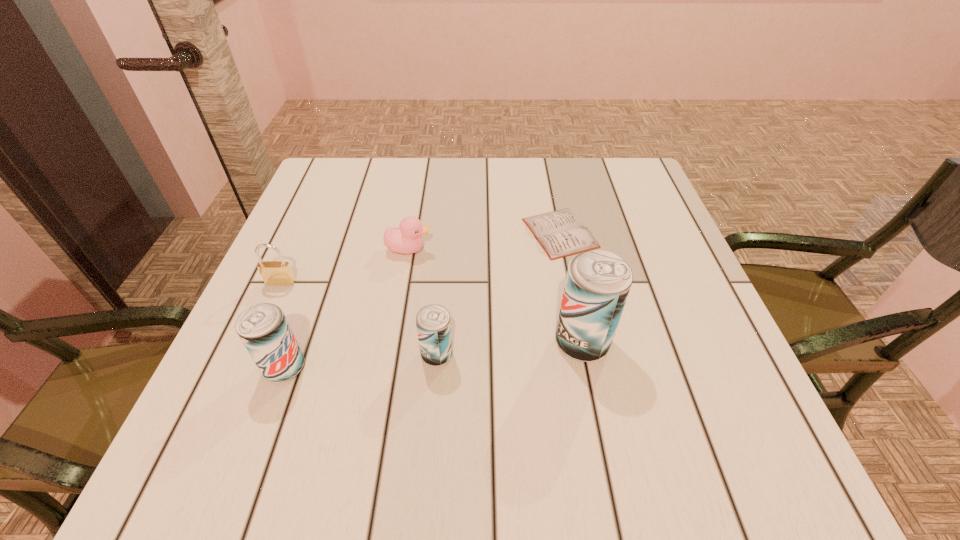
Locate an element on the screen. The image size is (960, 540). the second tallest beer can is located at coordinates (263, 328).

Locate an element on the screen. This screenshot has width=960, height=540. the fifth object from right to left is located at coordinates (263, 328).

This screenshot has height=540, width=960. What are the coordinates of `the second beer can from left to right` in the screenshot? It's located at (433, 324).

The height and width of the screenshot is (540, 960). I want to click on the shortest beer can, so click(x=433, y=324).

The width and height of the screenshot is (960, 540). I want to click on the rightmost beer can, so click(x=598, y=282).

Locate an element on the screen. This screenshot has width=960, height=540. the tallest object is located at coordinates (x=598, y=282).

Locate an element on the screen. This screenshot has width=960, height=540. the fifth tallest object is located at coordinates (x=407, y=239).

Locate an element on the screen. the fourth object from right to left is located at coordinates (407, 239).

Find the location of `diary`. diary is located at coordinates (561, 233).

The height and width of the screenshot is (540, 960). I want to click on padlock, so click(279, 273).